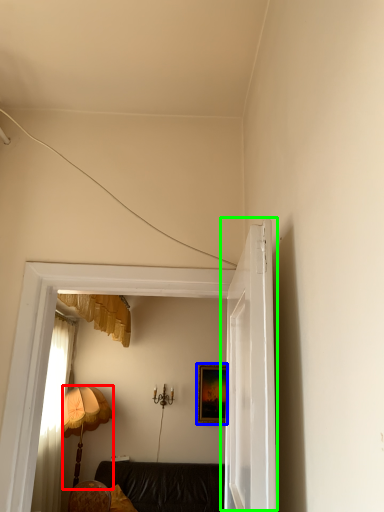
Question: Which is farther away from lamp (highlighted by a red box)? picture frame (highlighted by a blue box) or door (highlighted by a green box)?

Choices:
 (A) picture frame
 (B) door

Answer: (B)